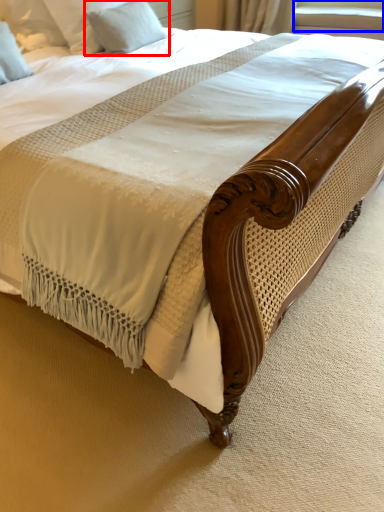
Question: Which of the following is the farthest to the observer, pillow (highlighted by a red box) or window screen (highlighted by a blue box)?

Choices:
 (A) pillow
 (B) window screen

Answer: (B)